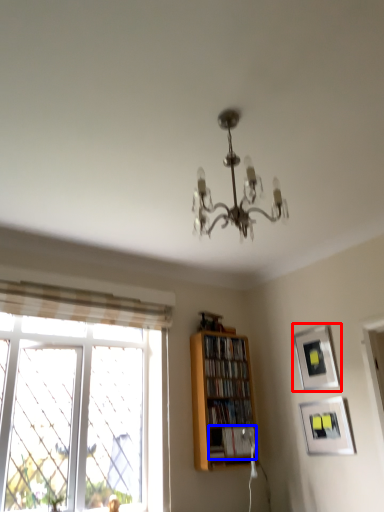
Question: Which of the following is the farthest to the observer, picture frame (highlighted by a red box) or book (highlighted by a blue box)?

Choices:
 (A) picture frame
 (B) book

Answer: (B)